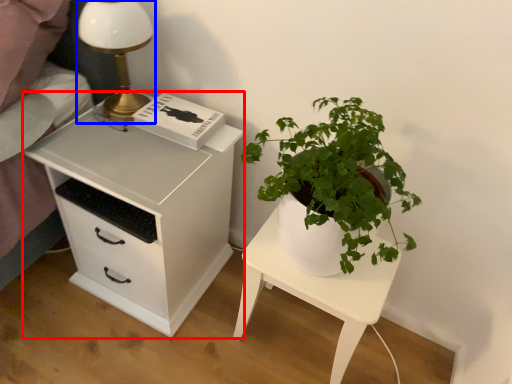
Question: Among these objects, which one is farthest to the camera, chest of drawers (highlighted by a red box) or table lamp (highlighted by a blue box)?

Choices:
 (A) chest of drawers
 (B) table lamp

Answer: (B)